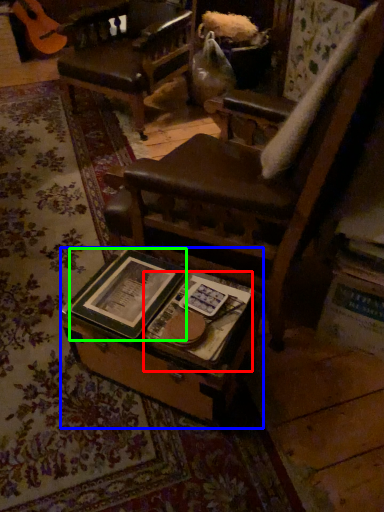
Question: Considering the real-world distances, which object is closest to paperback book (highlighted by a red box)? table (highlighted by a blue box) or paperback book (highlighted by a green box).

Choices:
 (A) table
 (B) paperback book

Answer: (A)